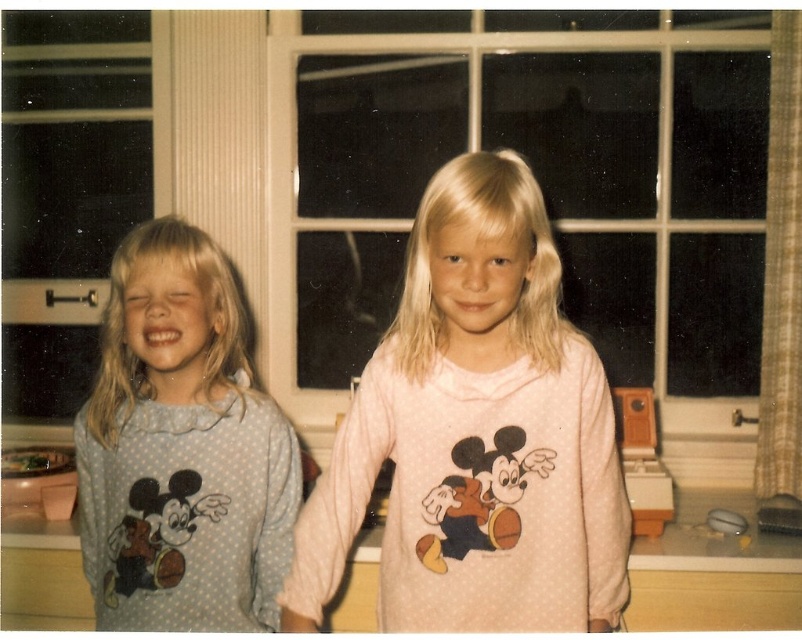
Question: Which point is farther to the camera?

Choices:
 (A) (343, 509)
 (B) (508, 68)

Answer: (B)

Question: Is clear glass window at center bigger than light blue dotted pajamas at left?

Choices:
 (A) no
 (B) yes

Answer: (B)

Question: Is clear glass window at center bigger than light blue dotted pajamas at left?

Choices:
 (A) no
 (B) yes

Answer: (B)

Question: Which object is positioned closest to the light blue dotted pajamas at left?

Choices:
 (A) clear glass window at center
 (B) pink soft fabric shirt at center

Answer: (B)

Question: Which point is farther from the camera taking this photo?

Choices:
 (A) 523,138
 (B) 460,394

Answer: (A)

Question: Does clear glass window at center have a larger size compared to pink soft fabric shirt at center?

Choices:
 (A) yes
 (B) no

Answer: (A)